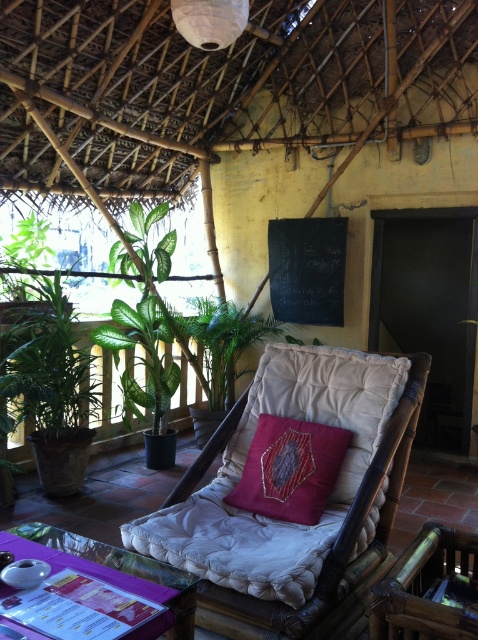
Question: Which is nearer to the beige fabric rocking chair at center?

Choices:
 (A) embroidered velvet cushion at center
 (B) brown leather armchair at lower right
 (C) transparent glass table at lower center
 (D) green leafy plant at left

Answer: (A)

Question: Which is farther from the brown leather armchair at lower right?

Choices:
 (A) beige fabric rocking chair at center
 (B) green leafy plant at left

Answer: (B)

Question: Which of the following is the closest to the observer?

Choices:
 (A) brown leather armchair at lower right
 (B) green leafy plant at left

Answer: (A)

Question: Is beige fabric rocking chair at center further to camera compared to brown leather armchair at lower right?

Choices:
 (A) yes
 (B) no

Answer: (A)

Question: Can you confirm if green leafy plant at left is positioned above brown leather armchair at lower right?

Choices:
 (A) yes
 (B) no

Answer: (A)

Question: Is beige fabric rocking chair at center further to camera compared to green leafy plant at left?

Choices:
 (A) no
 (B) yes

Answer: (A)